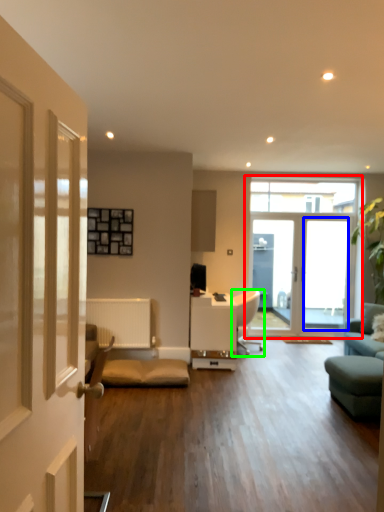
Question: Considering the real-world distances, which object is closest to window (highlighted by a red box)? window screen (highlighted by a blue box) or chair (highlighted by a green box).

Choices:
 (A) window screen
 (B) chair

Answer: (A)